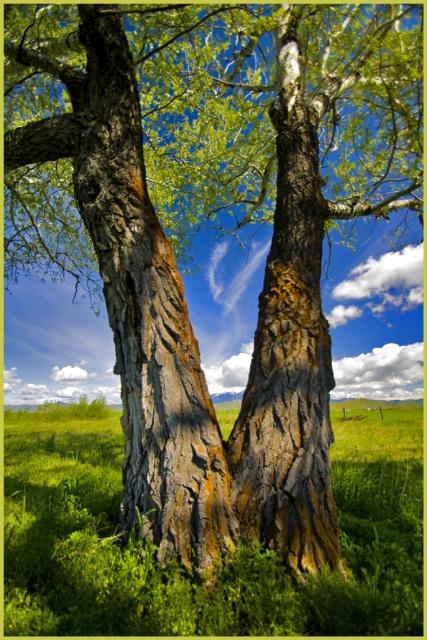
Between green grass at center and rough bark tree trunk at center, which one has more height?

Standing taller between the two is rough bark tree trunk at center.

From the picture: Is green grass at center in front of rough bark tree trunk at center?

Yes, it is in front of rough bark tree trunk at center.

The height and width of the screenshot is (640, 427). Find the location of `green grass at center`. green grass at center is located at coordinates (224, 563).